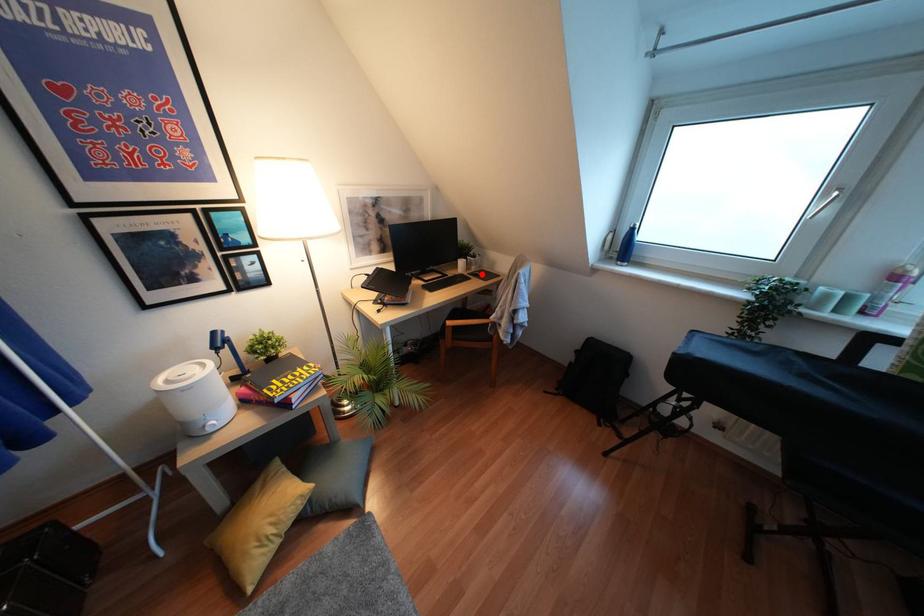
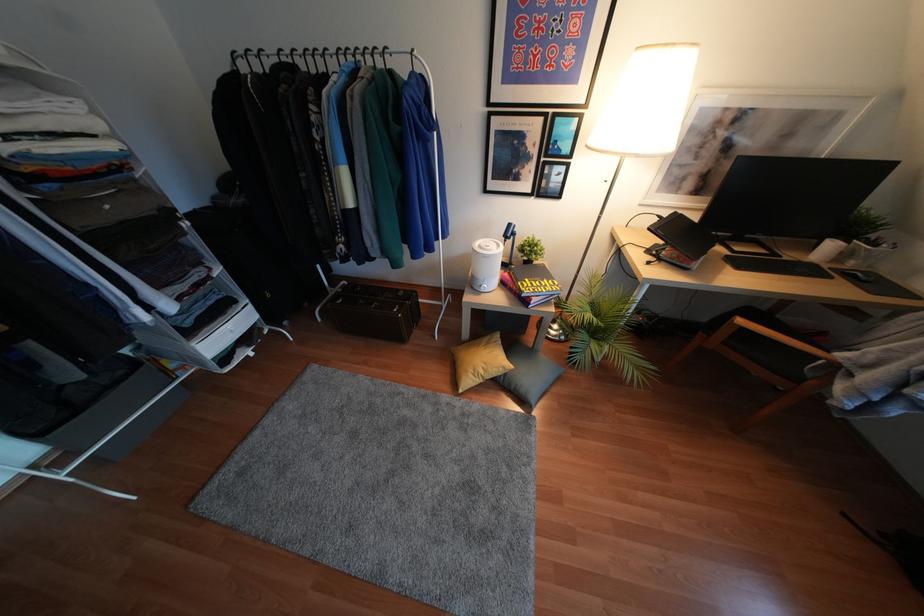
Question: I am providing you with two images of the same scene from different viewpoints. In image1, a red point is highlighted. Considering the same 3D point in image2, which of the following is correct?

Choices:
 (A) It is closer
 (B) It is farther

Answer: (B)